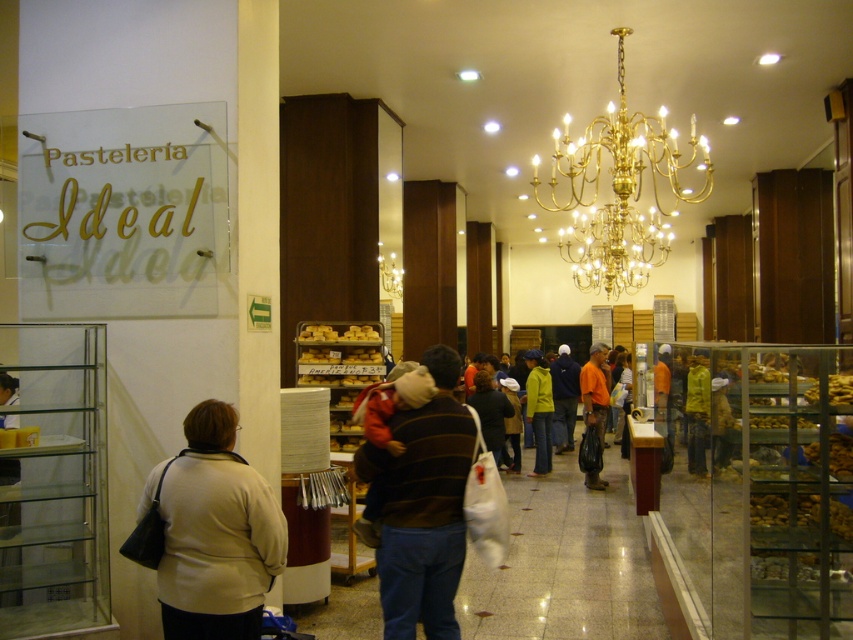
You are a customer in the bakery and want to carry both the beige sweater at lower left and the orange fabric bag at center. If you can only carry items within a 20 feet reach, can you comfortably carry both items at the same time?

The beige sweater at lower left and orange fabric bag at center are 20.73 feet apart, which exceeds the 20 feet reach limit. Therefore, you cannot comfortably carry both items at the same time.

You are a customer at Pasteleria Ideal bakery and you want to pick up your beige sweater at lower left and orange fabric bag at center. Which item should you grab first if you are approaching from the entrance located at the far right of the bakery?

Since the beige sweater at lower left is to the left of the orange fabric bag at center, and you are approaching from the far right entrance, you should grab the orange fabric bag at center first before reaching the beige sweater at lower left.